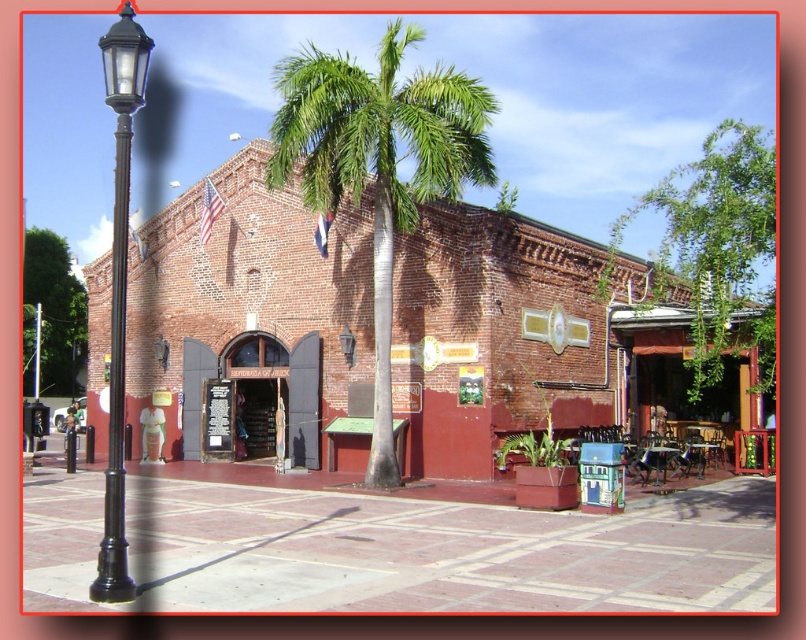
You are standing in front of the historic red brick building and want to place a small decorative item between the two points labeled point (721,236) and point (26,387). Which point should you start from to ensure the item is closer to the viewer?

You should start from point (721,236) because it is closer to the viewer than point (26,387).